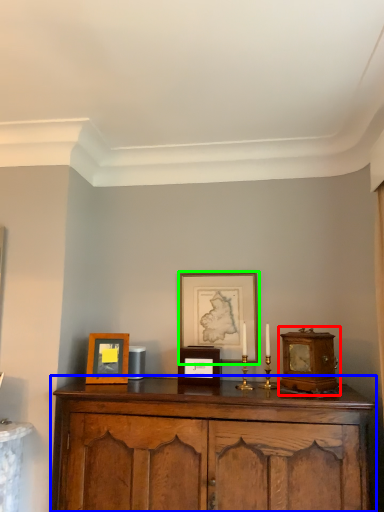
Question: Considering the real-world distances, which object is farthest from alarm clock (highlighted by a red box)? cabinetry (highlighted by a blue box) or picture frame (highlighted by a green box)?

Choices:
 (A) cabinetry
 (B) picture frame

Answer: (B)